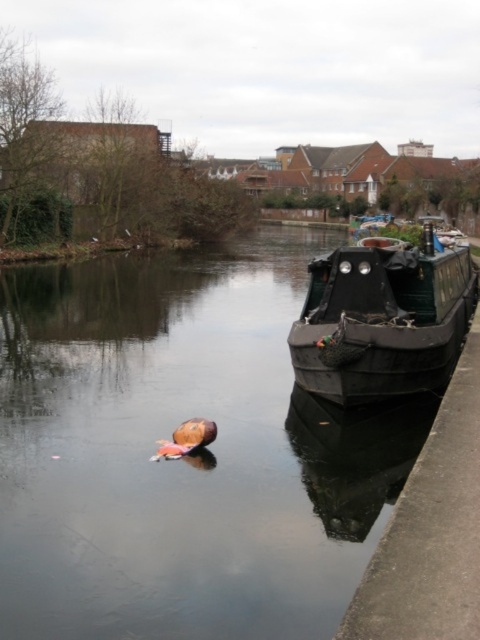
Between dark green wood boat at right and black matte boat at right, which one appears on the left side from the viewer's perspective?

dark green wood boat at right is more to the left.

Is dark green wood boat at right bigger than black matte boat at right?

Correct, dark green wood boat at right is larger in size than black matte boat at right.

Image resolution: width=480 pixels, height=640 pixels. What do you see at coordinates (183, 458) in the screenshot? I see `dark green wood boat at right` at bounding box center [183, 458].

At what (x,y) coordinates should I click in order to perform the action: click on dark green wood boat at right. Please return your answer as a coordinate pair (x, y). Looking at the image, I should click on (183, 458).